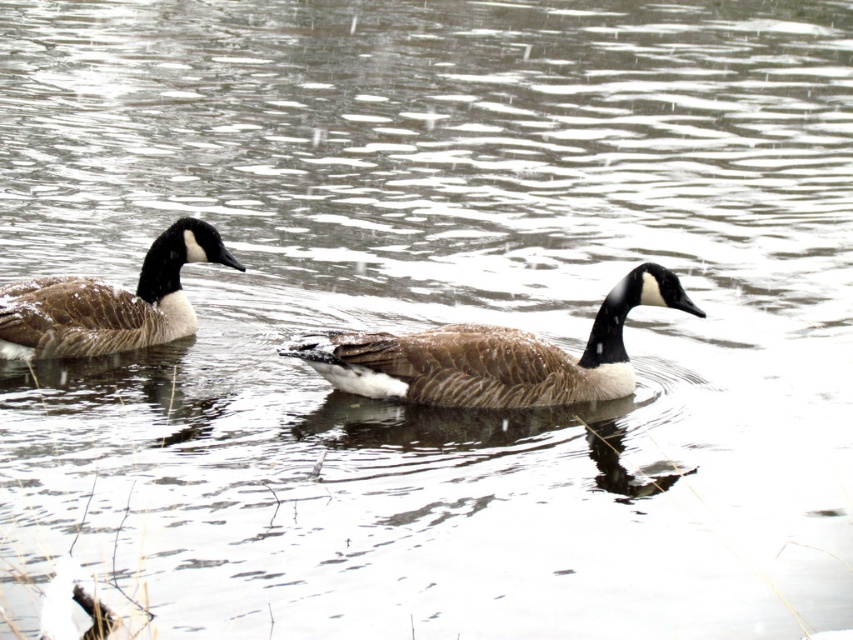
Question: Is brown feathered duck at center to the left of brown feathered duck at left from the viewer's perspective?

Choices:
 (A) yes
 (B) no

Answer: (B)

Question: Is brown feathered duck at center to the left of brown feathered duck at left from the viewer's perspective?

Choices:
 (A) no
 (B) yes

Answer: (A)

Question: Does brown feathered duck at center have a greater width compared to brown feathered duck at left?

Choices:
 (A) no
 (B) yes

Answer: (B)

Question: Which point appears closest to the camera in this image?

Choices:
 (A) (553, 355)
 (B) (3, 300)

Answer: (A)

Question: Which point is farther to the camera?

Choices:
 (A) brown feathered duck at center
 (B) brown feathered duck at left

Answer: (B)

Question: Which of the following is the closest to the observer?

Choices:
 (A) brown feathered duck at left
 (B) brown feathered duck at center

Answer: (B)